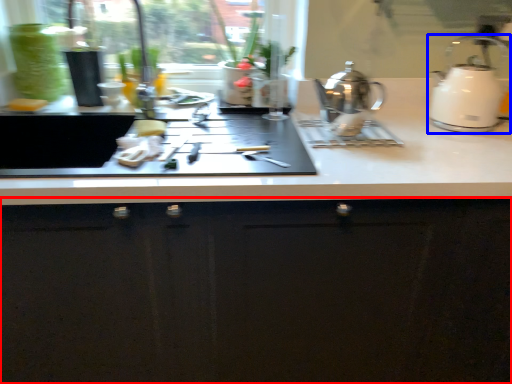
Question: Which of the following is the farthest to the observer, cabinetry (highlighted by a red box) or kettle (highlighted by a blue box)?

Choices:
 (A) cabinetry
 (B) kettle

Answer: (B)